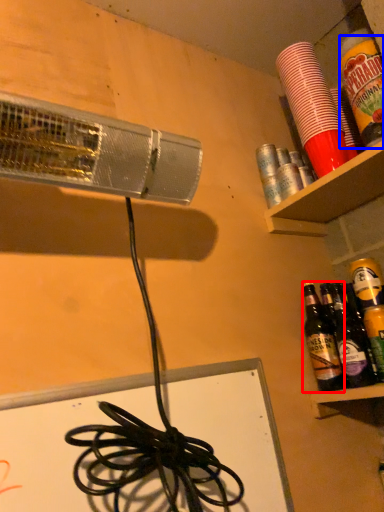
Question: Among these objects, which one is nearest to the camera, bottle (highlighted by a red box) or beverage (highlighted by a blue box)?

Choices:
 (A) bottle
 (B) beverage

Answer: (B)